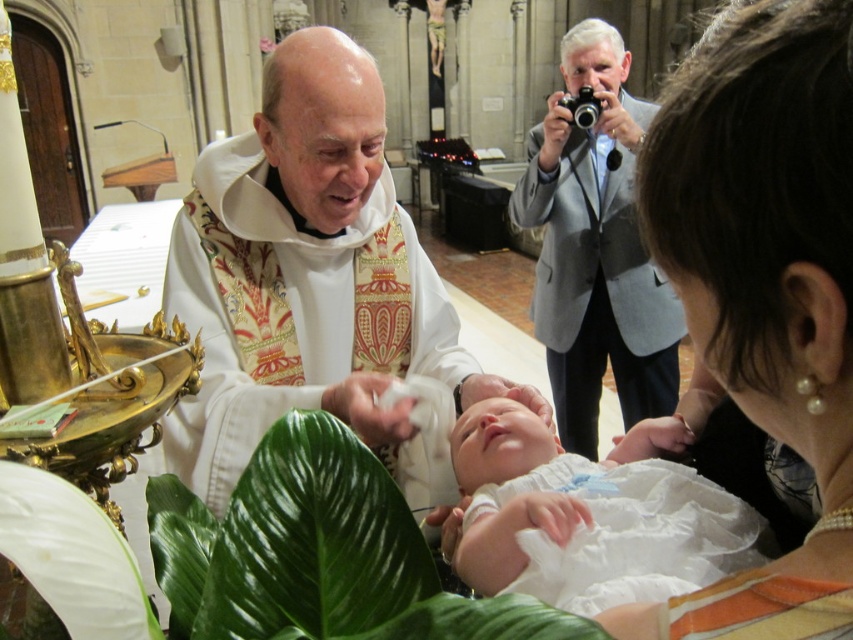
Between pearl earrings at upper right and white silk vestment at center, which one appears on the left side from the viewer's perspective?

From the viewer's perspective, white silk vestment at center appears more on the left side.

In order to click on pearl earrings at upper right in this screenshot , I will do `click(764, 289)`.

This screenshot has width=853, height=640. I want to click on pearl earrings at upper right, so click(x=764, y=289).

Looking at this image, can you confirm if pearl earrings at upper right is smaller than white clothed newborn at center?

Indeed, pearl earrings at upper right has a smaller size compared to white clothed newborn at center.

Which is behind, point (793, 35) or point (500, 529)?

The point (500, 529) is behind.

Identify the location of pearl earrings at upper right. The height and width of the screenshot is (640, 853). tap(764, 289).

Between white silk vestment at center and white clothed newborn at center, which one has less height?

With less height is white clothed newborn at center.

Does white silk vestment at center have a lesser height compared to white clothed newborn at center?

No, white silk vestment at center is not shorter than white clothed newborn at center.

Which is behind, point (355, 58) or point (531, 452)?

The point (355, 58) is behind.

I want to click on white silk vestment at center, so (x=306, y=275).